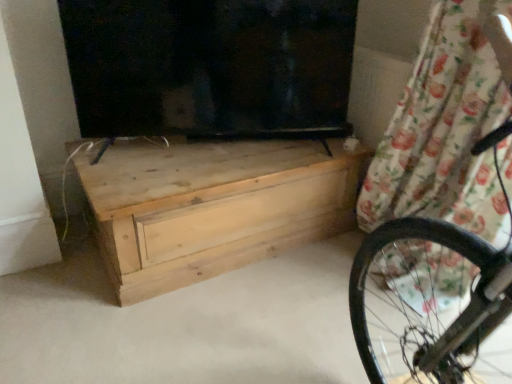
Find the location of a particular element. This screenshot has height=384, width=512. free space that is in between natural wood chest of drawers at center and floral fabric curtain at upper right is located at coordinates (279, 284).